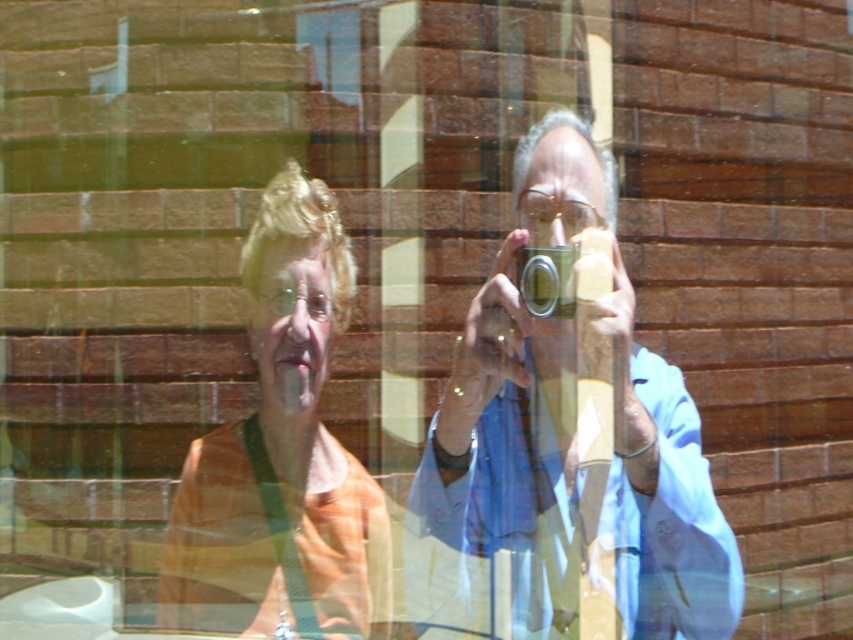
Does matte blue shirt at center appear on the left side of orange fabric at center?

Incorrect, matte blue shirt at center is not on the left side of orange fabric at center.

Does matte blue shirt at center lie behind orange fabric at center?

No, matte blue shirt at center is closer to the viewer.

Is point (495, 532) farther from viewer compared to point (268, 616)?

No, it is not.

At what (x,y) coordinates should I click in order to perform the action: click on matte blue shirt at center. Please return your answer as a coordinate pair (x, y). This screenshot has width=853, height=640. Looking at the image, I should click on (509, 413).

Which is more to the left, matte blue shirt at center or silver metallic camera at center?

matte blue shirt at center is more to the left.

This screenshot has height=640, width=853. Find the location of `matte blue shirt at center`. matte blue shirt at center is located at coordinates (509, 413).

From the picture: Who is positioned more to the left, orange fabric at center or silver metallic camera at center?

Positioned to the left is orange fabric at center.

Between point (305, 346) and point (563, 285), which one is positioned in front?

Point (563, 285) is in front.

Locate an element on the screen. This screenshot has height=640, width=853. orange fabric at center is located at coordinates (282, 456).

What are the coordinates of `orange fabric at center` in the screenshot? It's located at (282, 456).